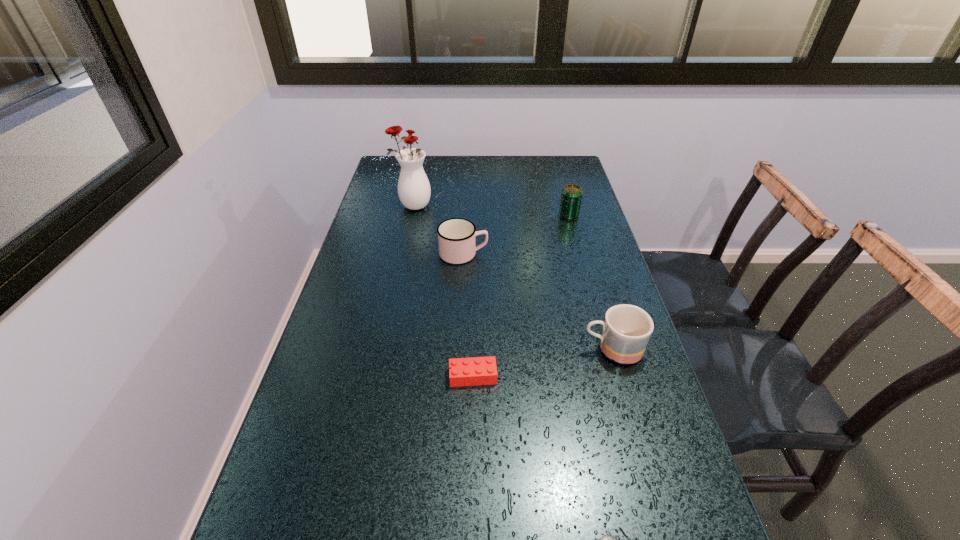
Where is `vacant space located 0.360m on the side with the handle of the right mug`? This screenshot has height=540, width=960. vacant space located 0.360m on the side with the handle of the right mug is located at coordinates (431, 349).

I want to click on vacant area located on the side with the handle of the right mug, so click(x=457, y=349).

The image size is (960, 540). I want to click on blank space located 0.360m on the side of the farther mug with the handle, so click(607, 254).

This screenshot has width=960, height=540. What are the coordinates of `free space located 0.260m on the back of the shortest object` in the screenshot? It's located at (474, 289).

Locate an element on the screen. The width and height of the screenshot is (960, 540). object present at the left edge is located at coordinates (414, 191).

At what (x,y) coordinates should I click in order to perform the action: click on beer can present at the right edge. Please return your answer as a coordinate pair (x, y). Looking at the image, I should click on (571, 198).

Locate an element on the screen. The image size is (960, 540). mug that is at the right edge is located at coordinates (626, 331).

You are a GUI agent. You are given a task and a screenshot of the screen. Output one action in this format:
    pyautogui.click(x=<x>, y=<y>)
    Task: Click on the free space at the far edge of the desktop
    
    Given the screenshot: What is the action you would take?
    pyautogui.click(x=519, y=176)

Locate an element on the screen. blank area at the left edge is located at coordinates (373, 222).

You are a GUI agent. You are given a task and a screenshot of the screen. Output one action in this format:
    pyautogui.click(x=<x>, y=<y>)
    Task: Click on the blank space at the right edge of the desktop
    The height and width of the screenshot is (540, 960).
    Given the screenshot: What is the action you would take?
    584,199